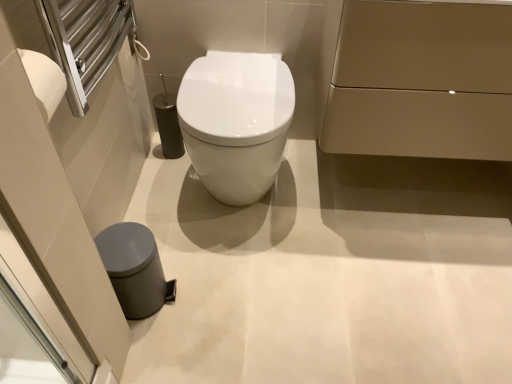
Question: Is white glossy toilet at center looking in the opposite direction of matte gold cabinet at upper right, acting as the second porcelain starting from the bottom?

Choices:
 (A) yes
 (B) no

Answer: (B)

Question: Considering the relative sizes of white glossy toilet at center and matte gold cabinet at upper right, acting as the 1th porcelain starting from the top, in the image provided, is white glossy toilet at center bigger than matte gold cabinet at upper right, acting as the 1th porcelain starting from the top,?

Choices:
 (A) no
 (B) yes

Answer: (A)

Question: From the image's perspective, is white glossy toilet at center below matte gold cabinet at upper right, positioned as the 1th porcelain in right-to-left order?

Choices:
 (A) yes
 (B) no

Answer: (A)

Question: Considering the relative sizes of white glossy toilet at center and matte gold cabinet at upper right, acting as the 1th porcelain starting from the top, in the image provided, is white glossy toilet at center smaller than matte gold cabinet at upper right, acting as the 1th porcelain starting from the top,?

Choices:
 (A) yes
 (B) no

Answer: (A)

Question: Considering the relative sizes of white glossy toilet at center and matte gold cabinet at upper right, the 2th porcelain from the left, in the image provided, is white glossy toilet at center thinner than matte gold cabinet at upper right, the 2th porcelain from the left,?

Choices:
 (A) yes
 (B) no

Answer: (B)

Question: Is white glossy toilet at center in front of or behind gray matte trash can at lower left, which is the 1th porcelain from bottom to top, in the image?

Choices:
 (A) behind
 (B) front

Answer: (A)

Question: Looking at their shapes, would you say white glossy toilet at center is wider or thinner than gray matte trash can at lower left, the second porcelain when ordered from right to left?

Choices:
 (A) thin
 (B) wide

Answer: (B)

Question: Is point (204, 94) closer or farther from the camera than point (131, 230)?

Choices:
 (A) closer
 (B) farther

Answer: (B)

Question: Looking at the image, does white glossy toilet at center seem bigger or smaller compared to gray matte trash can at lower left, the second porcelain when ordered from right to left?

Choices:
 (A) big
 (B) small

Answer: (A)

Question: From the image's perspective, relative to matte gold cabinet at upper right, the 2th porcelain from the left, is white glossy toilet at center above or below?

Choices:
 (A) above
 (B) below

Answer: (B)

Question: Looking at their shapes, would you say white glossy toilet at center is wider or thinner than matte gold cabinet at upper right, the 2th porcelain from the left?

Choices:
 (A) wide
 (B) thin

Answer: (A)

Question: In terms of size, does white glossy toilet at center appear bigger or smaller than matte gold cabinet at upper right, the 2th porcelain from the left?

Choices:
 (A) big
 (B) small

Answer: (B)

Question: Based on their positions, is white glossy toilet at center located to the left or right of matte gold cabinet at upper right, positioned as the 1th porcelain in right-to-left order?

Choices:
 (A) left
 (B) right

Answer: (A)

Question: From a real-world perspective, is matte gold cabinet at upper right, positioned as the 1th porcelain in right-to-left order, physically located above or below white glossy toilet at center?

Choices:
 (A) above
 (B) below

Answer: (A)

Question: Is matte gold cabinet at upper right, acting as the 1th porcelain starting from the top, taller or shorter than white glossy toilet at center?

Choices:
 (A) short
 (B) tall

Answer: (B)